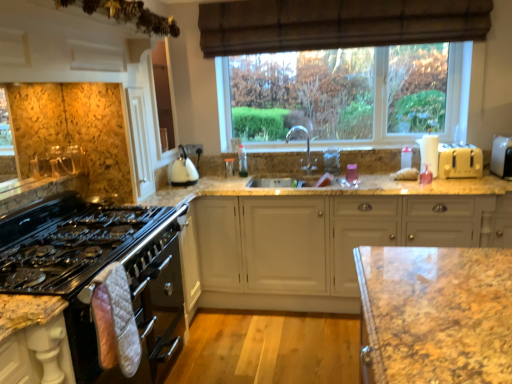
Question: Is black glass gas stove at left taller than white plastic toaster at right, which is the second appliance from right to left?

Choices:
 (A) yes
 (B) no

Answer: (B)

Question: Considering the relative positions of black glass gas stove at left and white plastic toaster at right, the first appliance viewed from the left, in the image provided, is black glass gas stove at left to the left of white plastic toaster at right, the first appliance viewed from the left, from the viewer's perspective?

Choices:
 (A) yes
 (B) no

Answer: (A)

Question: Is black glass gas stove at left facing away from white plastic toaster at right, which is the second appliance from right to left?

Choices:
 (A) no
 (B) yes

Answer: (A)

Question: Is black glass gas stove at left completely or partially outside of white plastic toaster at right, which is the second appliance from right to left?

Choices:
 (A) yes
 (B) no

Answer: (A)

Question: From a real-world perspective, is black glass gas stove at left located higher than white plastic toaster at right, the first appliance viewed from the left?

Choices:
 (A) yes
 (B) no

Answer: (B)

Question: From a real-world perspective, is granite countertop at center above or below white matte cabinet at center?

Choices:
 (A) above
 (B) below

Answer: (A)

Question: From the image's perspective, is granite countertop at center above or below white matte cabinet at center?

Choices:
 (A) below
 (B) above

Answer: (B)

Question: Is granite countertop at center in front of or behind white matte cabinet at center in the image?

Choices:
 (A) behind
 (B) front

Answer: (A)

Question: Considering the positions of granite countertop at center and white matte cabinet at center in the image, is granite countertop at center taller or shorter than white matte cabinet at center?

Choices:
 (A) tall
 (B) short

Answer: (B)

Question: Considering the relative positions of silver metallic faucet at center and white glossy kettle at upper center in the image provided, is silver metallic faucet at center to the left or to the right of white glossy kettle at upper center?

Choices:
 (A) right
 (B) left

Answer: (A)

Question: Considering the positions of point (307, 152) and point (189, 162), is point (307, 152) closer or farther from the camera than point (189, 162)?

Choices:
 (A) closer
 (B) farther

Answer: (B)

Question: Relative to white glossy kettle at upper center, is silver metallic faucet at center in front or behind?

Choices:
 (A) front
 (B) behind

Answer: (B)

Question: Is silver metallic faucet at center situated inside white glossy kettle at upper center or outside?

Choices:
 (A) inside
 (B) outside

Answer: (B)

Question: From the image's perspective, is white plastic toaster at right, positioned as the first appliance in right-to-left order, above or below granite countertop at center?

Choices:
 (A) above
 (B) below

Answer: (B)

Question: Relative to granite countertop at center, is white plastic toaster at right, which is the 2th appliance in left-to-right order, in front or behind?

Choices:
 (A) behind
 (B) front

Answer: (B)